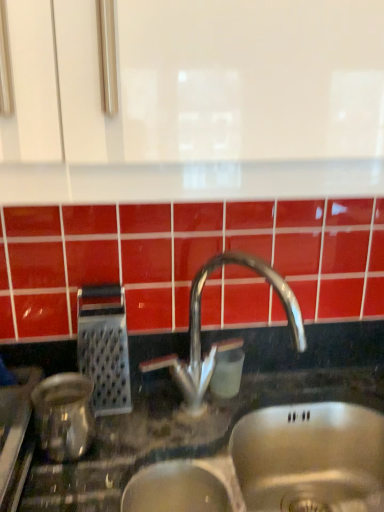
Question: Is metallic grater at left, which ranks as the second appliance in front-to-back order, to the left or to the right of polished metallic faucet at center in the image?

Choices:
 (A) right
 (B) left

Answer: (B)

Question: Does point (117, 298) appear closer or farther from the camera than point (231, 259)?

Choices:
 (A) farther
 (B) closer

Answer: (B)

Question: Which object is the farthest from the shiny metallic kettle at left, the 1th appliance positioned from the front?

Choices:
 (A) metallic grater at left, which ranks as the second appliance in front-to-back order
 (B) polished metallic faucet at center

Answer: (B)

Question: Estimate the real-world distances between objects in this image. Which object is closer to the metallic grater at left, the 1th appliance viewed from the back?

Choices:
 (A) polished metallic faucet at center
 (B) shiny metallic kettle at left, positioned as the 2th appliance in back-to-front order

Answer: (B)